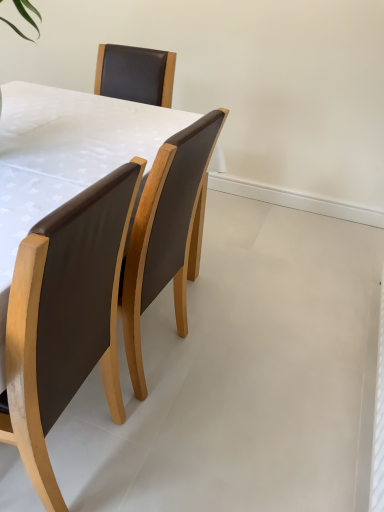
Question: Can you confirm if brown leather table at center is wider than brown leather chair at left?

Choices:
 (A) no
 (B) yes

Answer: (B)

Question: Is brown leather table at center smaller than brown leather chair at left?

Choices:
 (A) no
 (B) yes

Answer: (A)

Question: Is brown leather table at center bigger than brown leather chair at left?

Choices:
 (A) no
 (B) yes

Answer: (B)

Question: From a real-world perspective, is brown leather table at center physically above brown leather chair at left?

Choices:
 (A) yes
 (B) no

Answer: (B)

Question: Considering the relative positions of brown leather table at center and brown leather chair at left in the image provided, is brown leather table at center to the right of brown leather chair at left from the viewer's perspective?

Choices:
 (A) yes
 (B) no

Answer: (A)

Question: Considering the relative sizes of brown leather table at center and brown leather chair at left in the image provided, is brown leather table at center taller than brown leather chair at left?

Choices:
 (A) yes
 (B) no

Answer: (B)

Question: Is brown leather chair at left with brown leather table at center?

Choices:
 (A) yes
 (B) no

Answer: (B)

Question: Does brown leather chair at left have a lesser height compared to brown leather table at center?

Choices:
 (A) no
 (B) yes

Answer: (A)

Question: Is brown leather chair at left to the right of brown leather table at center from the viewer's perspective?

Choices:
 (A) no
 (B) yes

Answer: (A)

Question: From the image's perspective, would you say brown leather chair at left is shown under brown leather table at center?

Choices:
 (A) no
 (B) yes

Answer: (B)

Question: Would you say brown leather table at center is part of brown leather chair at left's contents?

Choices:
 (A) no
 (B) yes

Answer: (A)

Question: Is brown leather chair at left bigger than brown leather table at center?

Choices:
 (A) no
 (B) yes

Answer: (A)

Question: From the image's perspective, is brown leather table at center above or below brown leather chair at left?

Choices:
 (A) below
 (B) above

Answer: (B)